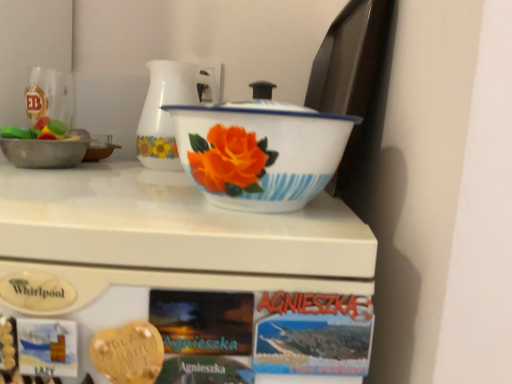
Question: Considering the relative sizes of white enamel basin at center and white glossy refrigerator at upper center in the image provided, is white enamel basin at center smaller than white glossy refrigerator at upper center?

Choices:
 (A) yes
 (B) no

Answer: (A)

Question: Is white enamel basin at center far away from white glossy refrigerator at upper center?

Choices:
 (A) no
 (B) yes

Answer: (A)

Question: Can you confirm if white enamel basin at center is positioned to the right of white glossy refrigerator at upper center?

Choices:
 (A) yes
 (B) no

Answer: (A)

Question: From the image's perspective, is white enamel basin at center below white glossy refrigerator at upper center?

Choices:
 (A) yes
 (B) no

Answer: (B)

Question: From a real-world perspective, is white enamel basin at center on top of white glossy refrigerator at upper center?

Choices:
 (A) yes
 (B) no

Answer: (A)

Question: Is golden heart-shaped cookie at center bigger or smaller than white glossy refrigerator at upper center?

Choices:
 (A) big
 (B) small

Answer: (B)

Question: Is golden heart-shaped cookie at center wider or thinner than white glossy refrigerator at upper center?

Choices:
 (A) thin
 (B) wide

Answer: (A)

Question: Considering their positions, is golden heart-shaped cookie at center located in front of or behind white glossy refrigerator at upper center?

Choices:
 (A) front
 (B) behind

Answer: (B)

Question: Would you say golden heart-shaped cookie at center is inside or outside white glossy refrigerator at upper center?

Choices:
 (A) inside
 (B) outside

Answer: (A)

Question: Is point (159, 167) closer or farther from the camera than point (53, 180)?

Choices:
 (A) farther
 (B) closer

Answer: (A)

Question: Considering the positions of white glossy jug at center and white glossy refrigerator at upper center in the image, is white glossy jug at center taller or shorter than white glossy refrigerator at upper center?

Choices:
 (A) short
 (B) tall

Answer: (A)

Question: Visually, is white glossy jug at center positioned to the left or to the right of white glossy refrigerator at upper center?

Choices:
 (A) right
 (B) left

Answer: (A)

Question: From the image's perspective, relative to white glossy refrigerator at upper center, is white glossy jug at center above or below?

Choices:
 (A) above
 (B) below

Answer: (A)

Question: Is white glossy refrigerator at upper center wider or thinner than white enamel basin at center?

Choices:
 (A) wide
 (B) thin

Answer: (A)

Question: Considering the positions of white glossy refrigerator at upper center and white enamel basin at center in the image, is white glossy refrigerator at upper center bigger or smaller than white enamel basin at center?

Choices:
 (A) small
 (B) big

Answer: (B)